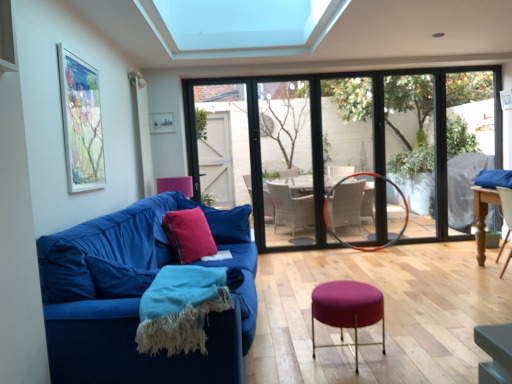
Question: From the image's perspective, is velvet blue couch at left on purple fabric stool at center?

Choices:
 (A) no
 (B) yes

Answer: (B)

Question: Is the depth of velvet blue couch at left less than that of purple fabric stool at center?

Choices:
 (A) yes
 (B) no

Answer: (A)

Question: Can you confirm if velvet blue couch at left is thinner than purple fabric stool at center?

Choices:
 (A) yes
 (B) no

Answer: (B)

Question: Does velvet blue couch at left lie behind purple fabric stool at center?

Choices:
 (A) no
 (B) yes

Answer: (A)

Question: Considering the relative sizes of velvet blue couch at left and purple fabric stool at center in the image provided, is velvet blue couch at left wider than purple fabric stool at center?

Choices:
 (A) no
 (B) yes

Answer: (B)

Question: From a real-world perspective, is velvet blue couch at left physically located above or below velvet red cushion at center left?

Choices:
 (A) above
 (B) below

Answer: (B)

Question: In the image, is velvet blue couch at left positioned in front of or behind velvet red cushion at center left?

Choices:
 (A) front
 (B) behind

Answer: (A)

Question: Visually, is velvet blue couch at left positioned to the left or to the right of velvet red cushion at center left?

Choices:
 (A) right
 (B) left

Answer: (B)

Question: Is point (x=160, y=210) closer or farther from the camera than point (x=214, y=246)?

Choices:
 (A) farther
 (B) closer

Answer: (A)

Question: Looking at their shapes, would you say orange metallic hula hoop at center is wider or thinner than matte glass picture frame at upper center, the 2th picture frame when ordered from front to back?

Choices:
 (A) wide
 (B) thin

Answer: (A)

Question: Would you say orange metallic hula hoop at center is inside or outside matte glass picture frame at upper center, the 2th picture frame when ordered from front to back?

Choices:
 (A) outside
 (B) inside

Answer: (A)

Question: Is point (323, 210) positioned closer to the camera than point (150, 129)?

Choices:
 (A) farther
 (B) closer

Answer: (A)

Question: From the image's perspective, is orange metallic hula hoop at center positioned above or below matte glass picture frame at upper center, the 2th picture frame when ordered from front to back?

Choices:
 (A) below
 (B) above

Answer: (A)

Question: From a real-world perspective, is velvet red cushion at center left positioned above or below purple fabric stool at center?

Choices:
 (A) below
 (B) above

Answer: (B)

Question: From the image's perspective, relative to purple fabric stool at center, is velvet red cushion at center left above or below?

Choices:
 (A) below
 (B) above

Answer: (B)